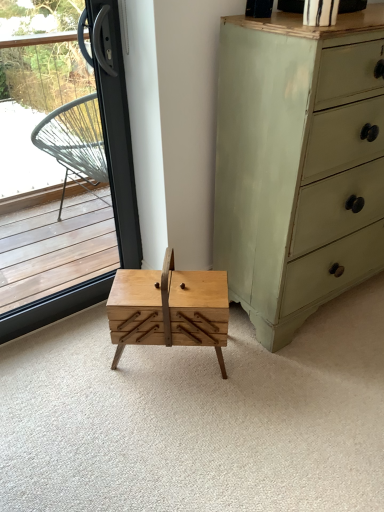
Question: Is light green painted wood chest of drawers at right further to the viewer compared to natural wood drawer at center?

Choices:
 (A) yes
 (B) no

Answer: (A)

Question: Is light green painted wood chest of drawers at right completely or partially outside of natural wood drawer at center?

Choices:
 (A) no
 (B) yes

Answer: (B)

Question: Considering the relative sizes of light green painted wood chest of drawers at right and natural wood drawer at center in the image provided, is light green painted wood chest of drawers at right shorter than natural wood drawer at center?

Choices:
 (A) no
 (B) yes

Answer: (A)

Question: Is light green painted wood chest of drawers at right smaller than natural wood drawer at center?

Choices:
 (A) yes
 (B) no

Answer: (B)

Question: Can you confirm if light green painted wood chest of drawers at right is positioned to the left of natural wood drawer at center?

Choices:
 (A) yes
 (B) no

Answer: (B)

Question: Considering the positions of point (349, 306) and point (134, 188), is point (349, 306) closer or farther from the camera than point (134, 188)?

Choices:
 (A) closer
 (B) farther

Answer: (B)

Question: In terms of height, does natural wood drawer at center look taller or shorter compared to transparent glass window at left?

Choices:
 (A) tall
 (B) short

Answer: (B)

Question: Based on their positions, is natural wood drawer at center located to the left or right of transparent glass window at left?

Choices:
 (A) right
 (B) left

Answer: (A)

Question: From the image's perspective, is natural wood drawer at center above or below transparent glass window at left?

Choices:
 (A) below
 (B) above

Answer: (A)

Question: Is natural wood table at center taller or shorter than transparent glass window at left?

Choices:
 (A) tall
 (B) short

Answer: (B)

Question: Do you think natural wood table at center is within transparent glass window at left, or outside of it?

Choices:
 (A) inside
 (B) outside

Answer: (B)

Question: From the image's perspective, is natural wood table at center located above or below transparent glass window at left?

Choices:
 (A) above
 (B) below

Answer: (B)

Question: From a real-world perspective, is natural wood table at center positioned above or below transparent glass window at left?

Choices:
 (A) above
 (B) below

Answer: (B)

Question: Is light green painted wood chest of drawers at right wider or thinner than natural wood drawer at center?

Choices:
 (A) wide
 (B) thin

Answer: (B)

Question: Relative to natural wood drawer at center, is light green painted wood chest of drawers at right in front or behind?

Choices:
 (A) behind
 (B) front

Answer: (A)